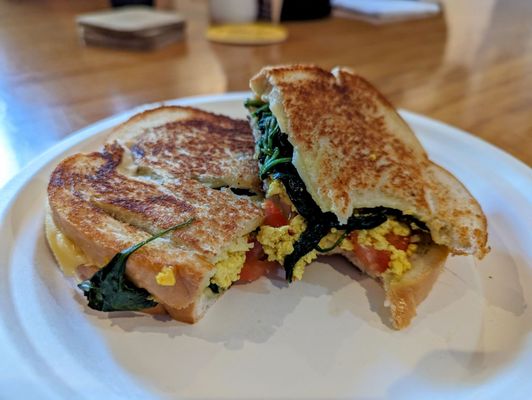
Where is `coaster`? The width and height of the screenshot is (532, 400). coaster is located at coordinates point(255,55).